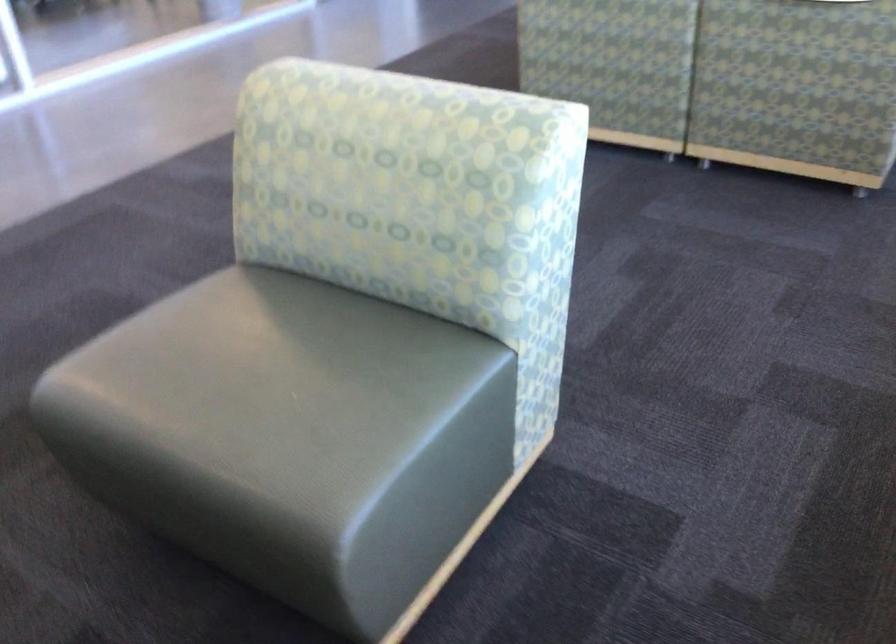
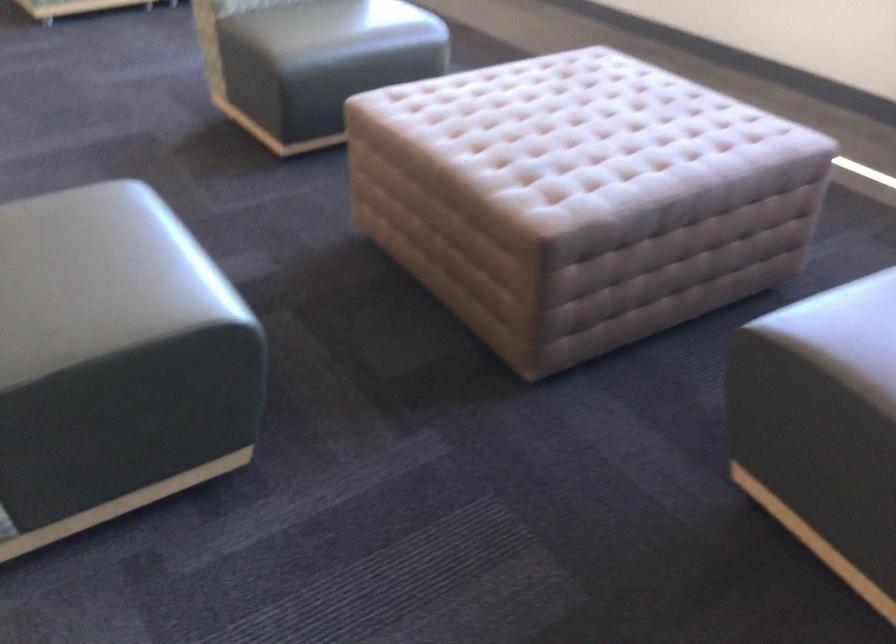
Locate, in the second image, the point that corresponds to point (184, 373) in the first image.

(334, 26)